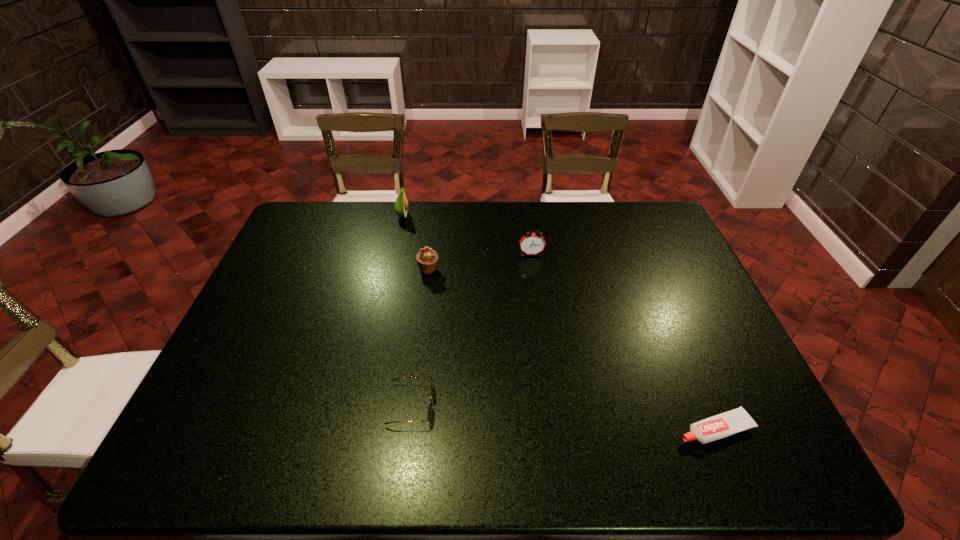
Where is `the farthest object`? This screenshot has height=540, width=960. the farthest object is located at coordinates (401, 204).

Locate an element on the screen. the leftmost object is located at coordinates (401, 204).

You are a GUI agent. You are given a task and a screenshot of the screen. Output one action in this format:
    pyautogui.click(x=<x>, y=<y>)
    Task: Click on the second farthest object
    Image resolution: width=960 pixels, height=540 pixels.
    Given the screenshot: What is the action you would take?
    pyautogui.click(x=532, y=243)

Where is `alarm clock`? This screenshot has height=540, width=960. alarm clock is located at coordinates click(532, 243).

The image size is (960, 540). What are the coordinates of `the third farthest object` in the screenshot? It's located at (x=427, y=258).

Image resolution: width=960 pixels, height=540 pixels. In order to click on the second shortest object in this screenshot , I will do `click(430, 403)`.

This screenshot has height=540, width=960. What are the coordinates of `the rightmost object` in the screenshot? It's located at (728, 423).

Where is `toothpaste`? toothpaste is located at coordinates (728, 423).

This screenshot has height=540, width=960. I want to click on vacant space situated on the cut side of the avocado, so click(x=445, y=217).

You are a GUI agent. You are given a task and a screenshot of the screen. Output one action in this format:
    pyautogui.click(x=<x>, y=<y>)
    Task: Click on the vacant region located on the clock face of the fourth object from left to right
    
    Given the screenshot: What is the action you would take?
    pyautogui.click(x=535, y=276)